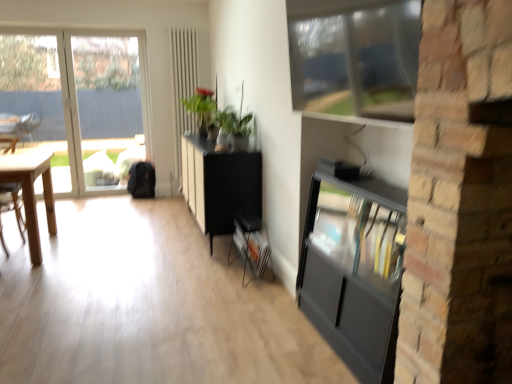
Question: Is black matte cabinet at center bigger than white matte radiator at upper center?

Choices:
 (A) yes
 (B) no

Answer: (A)

Question: Is black matte cabinet at center shorter than white matte radiator at upper center?

Choices:
 (A) no
 (B) yes

Answer: (B)

Question: From a real-world perspective, is black matte cabinet at center below white matte radiator at upper center?

Choices:
 (A) no
 (B) yes

Answer: (B)

Question: Could you tell me if black matte cabinet at center is facing white matte radiator at upper center?

Choices:
 (A) yes
 (B) no

Answer: (B)

Question: Does black matte cabinet at center have a greater height compared to white matte radiator at upper center?

Choices:
 (A) yes
 (B) no

Answer: (B)

Question: Can we say black matte cabinet at center lies outside white matte radiator at upper center?

Choices:
 (A) yes
 (B) no

Answer: (A)

Question: Does light wood desk at left appear on the left side of white matte radiator at upper center?

Choices:
 (A) yes
 (B) no

Answer: (A)

Question: From a real-world perspective, is light wood desk at left physically below white matte radiator at upper center?

Choices:
 (A) no
 (B) yes

Answer: (B)

Question: Would you say light wood desk at left is outside white matte radiator at upper center?

Choices:
 (A) no
 (B) yes

Answer: (B)

Question: Is light wood desk at left turned away from white matte radiator at upper center?

Choices:
 (A) no
 (B) yes

Answer: (A)

Question: Is light wood desk at left facing towards white matte radiator at upper center?

Choices:
 (A) yes
 (B) no

Answer: (B)

Question: Can you confirm if light wood desk at left is positioned to the right of white matte radiator at upper center?

Choices:
 (A) yes
 (B) no

Answer: (B)

Question: Is light wood desk at left shorter than transparent glass window at left, which is the second window from front to back?

Choices:
 (A) yes
 (B) no

Answer: (A)